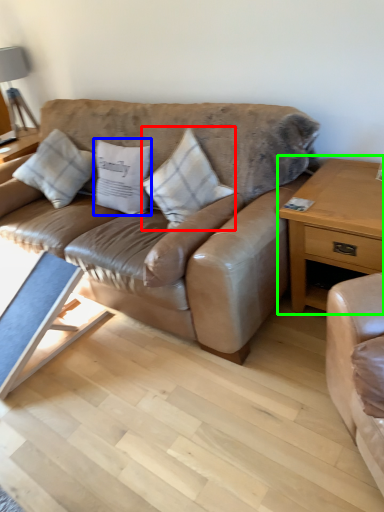
Question: Estimate the real-world distances between objects in this image. Which object is closer to pillow (highlighted by a red box), pillow (highlighted by a blue box) or nightstand (highlighted by a green box)?

Choices:
 (A) pillow
 (B) nightstand

Answer: (A)